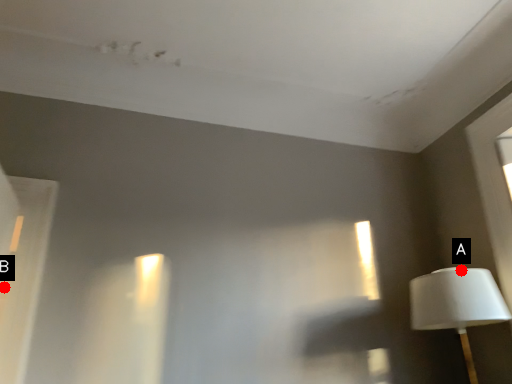
Question: Two points are circled on the image, labeled by A and B beside each circle. Among these points, which one is farthest from the camera?

Choices:
 (A) A is further
 (B) B is further

Answer: (A)